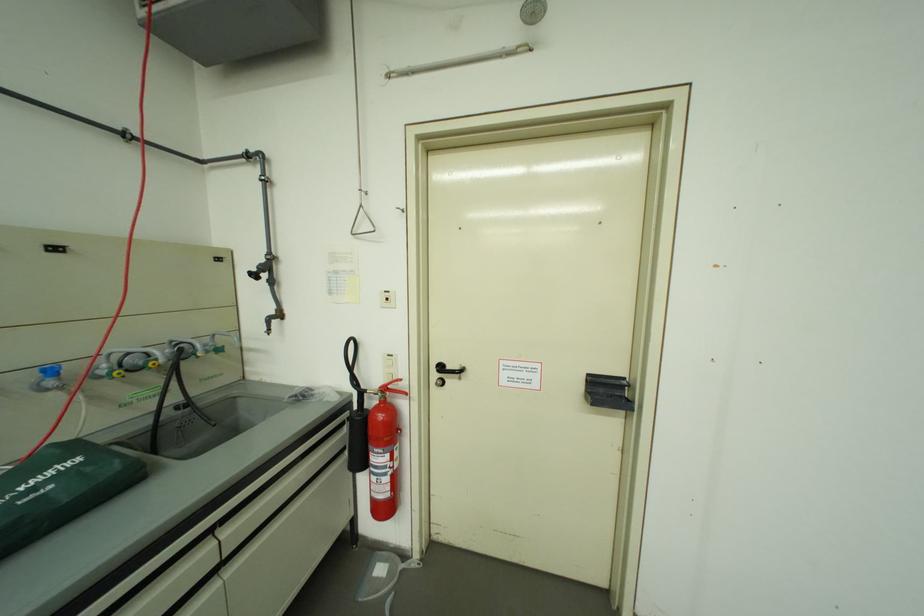
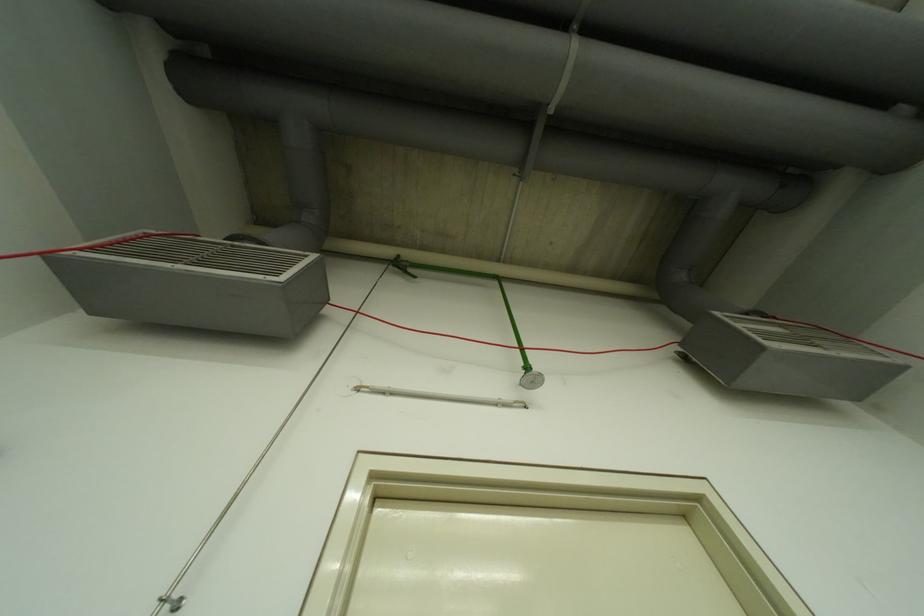
In the scene shown: How did the camera likely rotate?

The rotation direction of the camera is right-up.